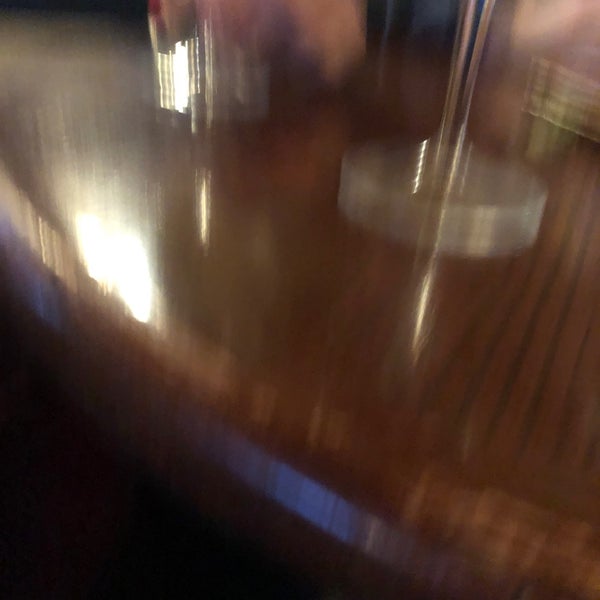
At what (x,y) coordinates should I click in order to perform the action: click on floor. Please return your answer as a coordinate pair (x, y). The image size is (600, 600). Looking at the image, I should click on (70, 472).